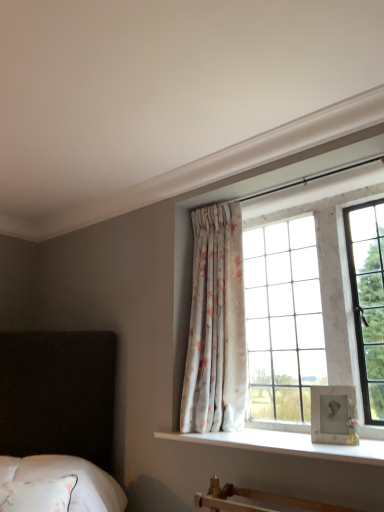
Where is `vacant region above floral fabric curtain at center (from a real-world perspective)`? The height and width of the screenshot is (512, 384). vacant region above floral fabric curtain at center (from a real-world perspective) is located at coordinates pos(218,202).